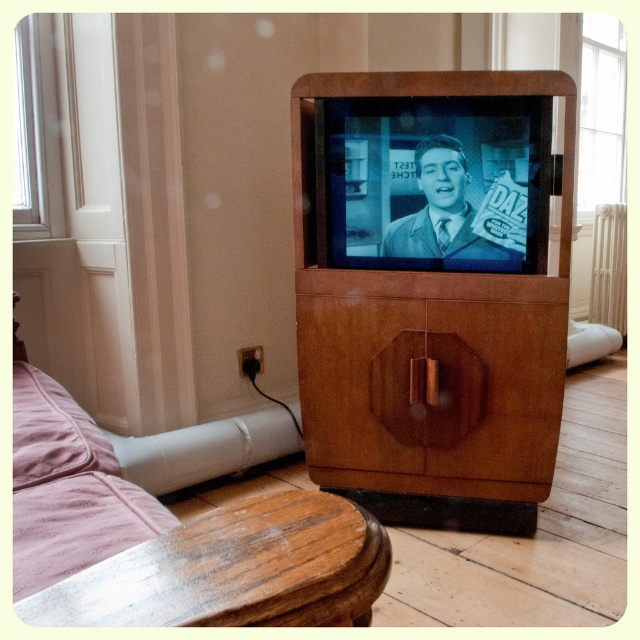
Question: Which of the following is the farthest from the observer?

Choices:
 (A) wooden cabinet at center
 (B) wooden side table at lower left

Answer: (A)

Question: Is wooden cabinet at center closer to camera compared to wooden side table at lower left?

Choices:
 (A) no
 (B) yes

Answer: (A)

Question: Is wooden cabinet at center to the left of wooden side table at lower left from the viewer's perspective?

Choices:
 (A) no
 (B) yes

Answer: (A)

Question: Is wooden cabinet at center above wooden side table at lower left?

Choices:
 (A) yes
 (B) no

Answer: (A)